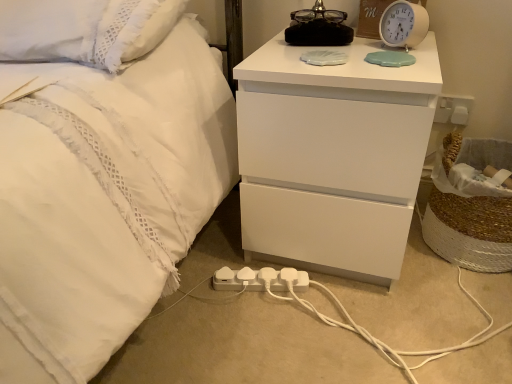
Where is `vacant space in front of white matte nightstand at upper right`? This screenshot has height=384, width=512. vacant space in front of white matte nightstand at upper right is located at coordinates (348, 333).